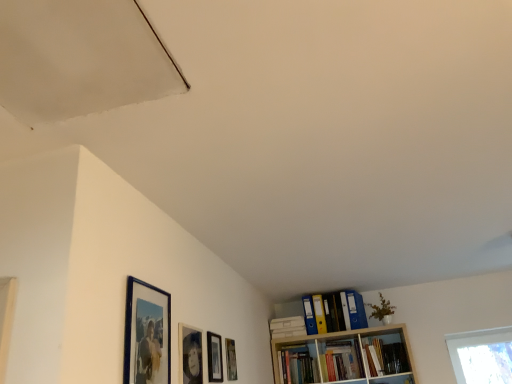
Question: Is point (320, 314) positioned closer to the camera than point (197, 360)?

Choices:
 (A) closer
 (B) farther

Answer: (B)

Question: Is yellow file folder at upper right, marked as the 2th book in a right-to-left arrangement, inside the boundaries of matte black picture frame at lower center, arranged as the 3th picture frame when viewed from the right, or outside?

Choices:
 (A) outside
 (B) inside

Answer: (A)

Question: Estimate the real-world distances between objects in this image. Which object is closer to the matte black picture frame at center, which is counted as the 2th picture frame, starting from the right?

Choices:
 (A) hardcover book at upper right, which is the 1th book from right to left
 (B) smooth white exhaust hood at upper left
 (C) blue glossy picture frame at upper left, the fourth picture frame in the back-to-front sequence
 (D) matte black picture frame at lower center, which is the second picture frame from left to right
 (E) matte wooden picture frame at lower center, the 4th picture frame viewed from the front

Answer: (E)

Question: Based on their relative distances, which object is farther from the smooth white exhaust hood at upper left?

Choices:
 (A) hardcover book at upper right, which is the 1th book from right to left
 (B) matte black picture frame at lower center, which is the second picture frame from left to right
 (C) matte wooden picture frame at lower center, marked as the 4th picture frame in a left-to-right arrangement
 (D) yellow file folder at upper right, placed as the 1th book when sorted from left to right
 (E) blue glossy picture frame at upper left, which is the 4th picture frame from right to left

Answer: (A)